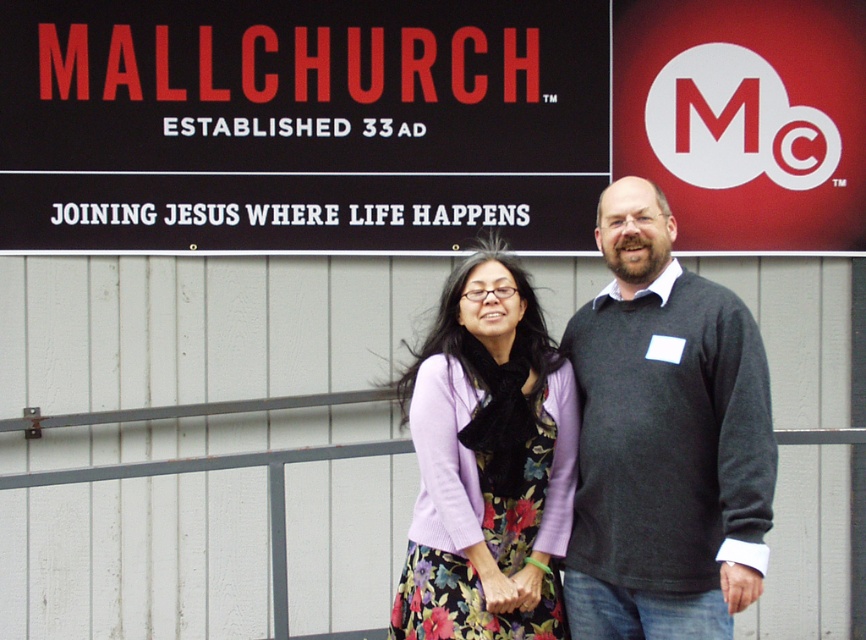
Question: Which of the following is the farthest from the observer?

Choices:
 (A) purple knitted sweater at center
 (B) black sign at upper center
 (C) dark gray sweater at center

Answer: (B)

Question: Can you confirm if black sign at upper center is positioned to the left of dark gray sweater at center?

Choices:
 (A) yes
 (B) no

Answer: (A)

Question: Is black sign at upper center below purple knitted sweater at center?

Choices:
 (A) yes
 (B) no

Answer: (B)

Question: In this image, where is black sign at upper center located relative to purple knitted sweater at center?

Choices:
 (A) above
 (B) below

Answer: (A)

Question: Which of the following is the farthest from the observer?

Choices:
 (A) (397, 588)
 (B) (651, 168)

Answer: (A)

Question: Which of these objects is positioned closest to the dark gray sweater at center?

Choices:
 (A) black sign at upper center
 (B) purple knitted sweater at center

Answer: (B)